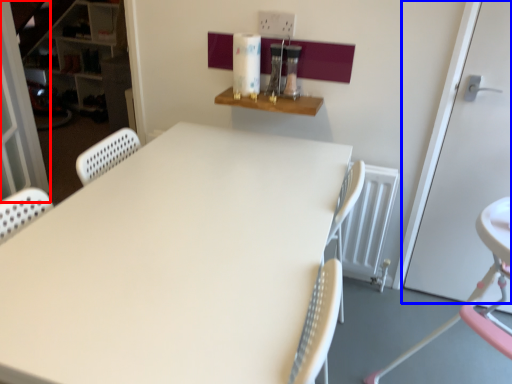
Question: Among these objects, which one is nearest to the camera, screen door (highlighted by a red box) or door (highlighted by a blue box)?

Choices:
 (A) screen door
 (B) door

Answer: (B)